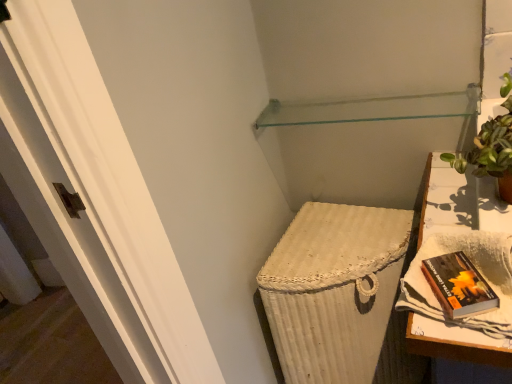
Question: Is hardcover book at right to the left or to the right of transparent glass shelf at upper center in the image?

Choices:
 (A) left
 (B) right

Answer: (B)

Question: Considering the positions of hardcover book at right and transparent glass shelf at upper center in the image, is hardcover book at right taller or shorter than transparent glass shelf at upper center?

Choices:
 (A) tall
 (B) short

Answer: (A)

Question: Based on their relative distances, which object is farther from the hardcover book at right?

Choices:
 (A) green leafy plant in terracotta pot at upper right
 (B) transparent glass shelf at upper center
 (C) white woven table at right

Answer: (B)

Question: Estimate the real-world distances between objects in this image. Which object is closer to the transparent glass shelf at upper center?

Choices:
 (A) green leafy plant in terracotta pot at upper right
 (B) white woven table at right
 (C) hardcover book at right

Answer: (A)